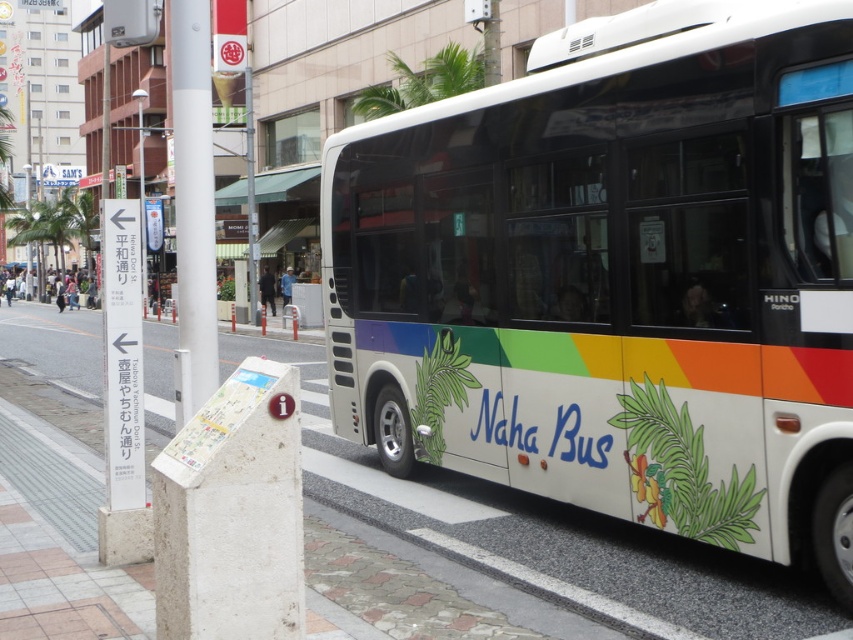
Can you confirm if white glossy bus at right is bigger than white concrete pavement at lower center?

Actually, white glossy bus at right might be smaller than white concrete pavement at lower center.

I want to click on white glossy bus at right, so 618,276.